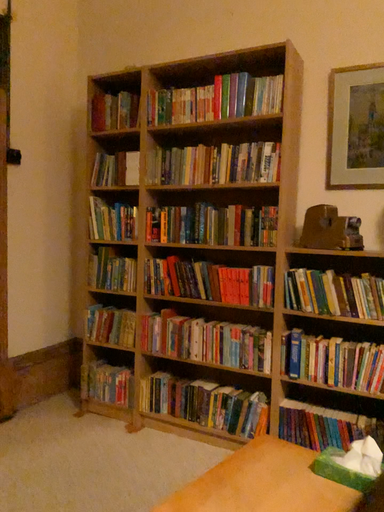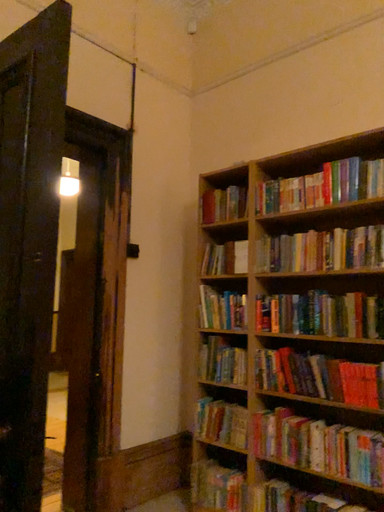
Question: How did the camera likely rotate when shooting the video?

Choices:
 (A) rotated upward
 (B) rotated downward

Answer: (A)